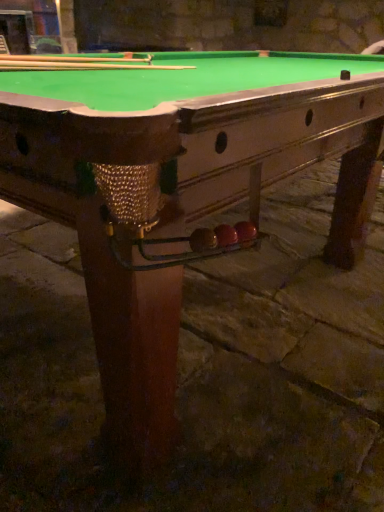
What do you see at coordinates (83, 66) in the screenshot?
I see `smooth wood cue at upper left, which is counted as the 2th cue, starting from the front` at bounding box center [83, 66].

Where is `smooth wood cue at upper left, which is counted as the 2th cue, starting from the front`? smooth wood cue at upper left, which is counted as the 2th cue, starting from the front is located at coordinates (83, 66).

What do you see at coordinates (73, 59) in the screenshot? The image size is (384, 512). I see `wooden cue at upper center, marked as the first cue in a front-to-back arrangement` at bounding box center [73, 59].

Find the location of `wooden cue at upper center, the second cue when ordered from back to front`. wooden cue at upper center, the second cue when ordered from back to front is located at coordinates (73, 59).

At what (x,y) coordinates should I click in order to perform the action: click on smooth wood cue at upper left, which is counted as the 2th cue, starting from the front. Please return your answer as a coordinate pair (x, y). This screenshot has height=512, width=384. Looking at the image, I should click on pyautogui.click(x=83, y=66).

In the image, is smooth wood cue at upper left, acting as the 1th cue starting from the back, on the left side or the right side of wooden cue at upper center, the second cue when ordered from back to front?

smooth wood cue at upper left, acting as the 1th cue starting from the back, is to the right of wooden cue at upper center, the second cue when ordered from back to front.

Which object is more forward, smooth wood cue at upper left, which is counted as the 2th cue, starting from the front, or wooden cue at upper center, the second cue when ordered from back to front?

wooden cue at upper center, the second cue when ordered from back to front.

Is point (3, 61) less distant than point (104, 58)?

Yes, point (3, 61) is in front of point (104, 58).

From the image's perspective, is smooth wood cue at upper left, acting as the 1th cue starting from the back, above or below wooden cue at upper center, the second cue when ordered from back to front?

smooth wood cue at upper left, acting as the 1th cue starting from the back, is below wooden cue at upper center, the second cue when ordered from back to front.

From a real-world perspective, relative to wooden cue at upper center, marked as the first cue in a front-to-back arrangement, is smooth wood cue at upper left, which is counted as the 2th cue, starting from the front, vertically above or below?

From a real-world perspective, smooth wood cue at upper left, which is counted as the 2th cue, starting from the front, is physically below wooden cue at upper center, marked as the first cue in a front-to-back arrangement.

In terms of width, does smooth wood cue at upper left, acting as the 1th cue starting from the back, look wider or thinner when compared to wooden cue at upper center, the second cue when ordered from back to front?

In the image, smooth wood cue at upper left, acting as the 1th cue starting from the back, appears to be wider than wooden cue at upper center, the second cue when ordered from back to front.

Looking at this image, between smooth wood cue at upper left, acting as the 1th cue starting from the back, and wooden cue at upper center, the second cue when ordered from back to front, which one has less height?

With less height is smooth wood cue at upper left, acting as the 1th cue starting from the back.

Can you confirm if smooth wood cue at upper left, acting as the 1th cue starting from the back, is smaller than wooden cue at upper center, marked as the first cue in a front-to-back arrangement?

Yes, smooth wood cue at upper left, acting as the 1th cue starting from the back, is smaller than wooden cue at upper center, marked as the first cue in a front-to-back arrangement.

Is smooth wood cue at upper left, which is counted as the 2th cue, starting from the front, completely or partially outside of wooden cue at upper center, the second cue when ordered from back to front?

That's correct, smooth wood cue at upper left, which is counted as the 2th cue, starting from the front, is outside of wooden cue at upper center, the second cue when ordered from back to front.

Is the surface of smooth wood cue at upper left, which is counted as the 2th cue, starting from the front, in direct contact with wooden cue at upper center, marked as the first cue in a front-to-back arrangement?

Indeed, smooth wood cue at upper left, which is counted as the 2th cue, starting from the front, and wooden cue at upper center, marked as the first cue in a front-to-back arrangement, are beside each other and touching.

From the picture: Could you tell me if smooth wood cue at upper left, which is counted as the 2th cue, starting from the front, is facing wooden cue at upper center, marked as the first cue in a front-to-back arrangement?

No, smooth wood cue at upper left, which is counted as the 2th cue, starting from the front, is not oriented towards wooden cue at upper center, marked as the first cue in a front-to-back arrangement.

How many degrees apart are the facing directions of smooth wood cue at upper left, acting as the 1th cue starting from the back, and wooden cue at upper center, marked as the first cue in a front-to-back arrangement?

smooth wood cue at upper left, acting as the 1th cue starting from the back, and wooden cue at upper center, marked as the first cue in a front-to-back arrangement, are facing 0.00124 degrees away from each other.

Image resolution: width=384 pixels, height=512 pixels. I want to click on cue lying behind the wooden cue at upper center, marked as the first cue in a front-to-back arrangement, so click(x=83, y=66).

Is wooden cue at upper center, marked as the first cue in a front-to-back arrangement, to the left of smooth wood cue at upper left, acting as the 1th cue starting from the back, from the viewer's perspective?

Yes, wooden cue at upper center, marked as the first cue in a front-to-back arrangement, is to the left of smooth wood cue at upper left, acting as the 1th cue starting from the back.

Considering the relative positions of wooden cue at upper center, the second cue when ordered from back to front, and smooth wood cue at upper left, which is counted as the 2th cue, starting from the front, in the image provided, is wooden cue at upper center, the second cue when ordered from back to front, behind smooth wood cue at upper left, which is counted as the 2th cue, starting from the front,?

No, wooden cue at upper center, the second cue when ordered from back to front, is in front of smooth wood cue at upper left, which is counted as the 2th cue, starting from the front.

Does point (141, 59) appear closer or farther from the camera than point (75, 67)?

Point (141, 59).

From the image's perspective, relative to smooth wood cue at upper left, acting as the 1th cue starting from the back, is wooden cue at upper center, the second cue when ordered from back to front, above or below?

Based on their image positions, wooden cue at upper center, the second cue when ordered from back to front, is located above smooth wood cue at upper left, acting as the 1th cue starting from the back.

From a real-world perspective, which is physically above, wooden cue at upper center, marked as the first cue in a front-to-back arrangement, or smooth wood cue at upper left, acting as the 1th cue starting from the back?

From a 3D spatial view, wooden cue at upper center, marked as the first cue in a front-to-back arrangement, is above.

Which of these two, wooden cue at upper center, marked as the first cue in a front-to-back arrangement, or smooth wood cue at upper left, which is counted as the 2th cue, starting from the front, is thinner?

With smaller width is wooden cue at upper center, marked as the first cue in a front-to-back arrangement.

Who is shorter, wooden cue at upper center, the second cue when ordered from back to front, or smooth wood cue at upper left, acting as the 1th cue starting from the back?

smooth wood cue at upper left, acting as the 1th cue starting from the back.

Who is bigger, wooden cue at upper center, the second cue when ordered from back to front, or smooth wood cue at upper left, which is counted as the 2th cue, starting from the front?

With larger size is wooden cue at upper center, the second cue when ordered from back to front.

Choose the correct answer: Is wooden cue at upper center, marked as the first cue in a front-to-back arrangement, inside smooth wood cue at upper left, which is counted as the 2th cue, starting from the front, or outside it?

wooden cue at upper center, marked as the first cue in a front-to-back arrangement, is not enclosed by smooth wood cue at upper left, which is counted as the 2th cue, starting from the front.

Is wooden cue at upper center, the second cue when ordered from back to front, touching smooth wood cue at upper left, which is counted as the 2th cue, starting from the front?

Yes, wooden cue at upper center, the second cue when ordered from back to front, is right next to smooth wood cue at upper left, which is counted as the 2th cue, starting from the front, and making contact.

Could you tell me if wooden cue at upper center, marked as the first cue in a front-to-back arrangement, is facing smooth wood cue at upper left, acting as the 1th cue starting from the back?

No, wooden cue at upper center, marked as the first cue in a front-to-back arrangement, is not facing towards smooth wood cue at upper left, acting as the 1th cue starting from the back.

Can you tell me how much wooden cue at upper center, marked as the first cue in a front-to-back arrangement, and smooth wood cue at upper left, which is counted as the 2th cue, starting from the front, differ in facing direction?

They differ by 0.00124 degrees in their facing directions.

Measure the distance between wooden cue at upper center, the second cue when ordered from back to front, and smooth wood cue at upper left, which is counted as the 2th cue, starting from the front.

They are 3.88 inches apart.

Image resolution: width=384 pixels, height=512 pixels. In order to click on cue on the left of smooth wood cue at upper left, acting as the 1th cue starting from the back in this screenshot , I will do `click(73, 59)`.

Image resolution: width=384 pixels, height=512 pixels. I want to click on cue behind the wooden cue at upper center, the second cue when ordered from back to front, so coord(83,66).

In the image, there is a smooth wood cue at upper left, which is counted as the 2th cue, starting from the front. At what (x,y) coordinates should I click in order to perform the action: click on cue above it (from the image's perspective). Please return your answer as a coordinate pair (x, y). The height and width of the screenshot is (512, 384). Looking at the image, I should click on (73, 59).